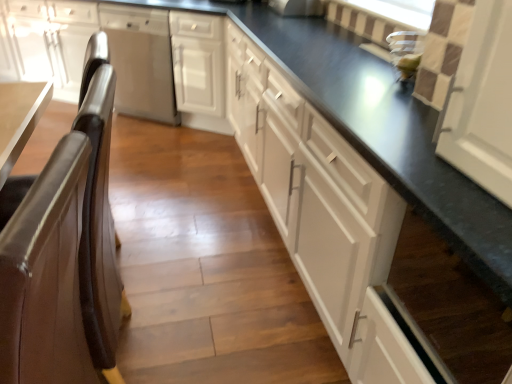
Question: Can we say brown leather chair at left lies outside white matte cabinet at center, marked as the 3th cabinetry in a left-to-right arrangement?

Choices:
 (A) no
 (B) yes

Answer: (B)

Question: From the image's perspective, is brown leather chair at left below white matte cabinet at center, marked as the 3th cabinetry in a left-to-right arrangement?

Choices:
 (A) no
 (B) yes

Answer: (B)

Question: Could you tell me if brown leather chair at left is turned towards white matte cabinet at center, marked as the 3th cabinetry in a left-to-right arrangement?

Choices:
 (A) yes
 (B) no

Answer: (B)

Question: Does brown leather chair at left have a smaller size compared to white matte cabinet at center, the first cabinetry positioned from the right?

Choices:
 (A) yes
 (B) no

Answer: (A)

Question: Would you say brown leather chair at left is a long distance from white matte cabinet at center, the first cabinetry positioned from the right?

Choices:
 (A) no
 (B) yes

Answer: (A)

Question: From the image's perspective, would you say brown leather chair at left is positioned over white matte cabinet at center, the first cabinetry positioned from the right?

Choices:
 (A) no
 (B) yes

Answer: (A)

Question: Is white matte cabinet at center, which is the 2th cabinetry in left-to-right order, thinner than white matte cabinet at center, marked as the 3th cabinetry in a left-to-right arrangement?

Choices:
 (A) yes
 (B) no

Answer: (B)

Question: Would you say white matte cabinet at center, the first cabinetry positioned from the right, is part of white matte cabinet at center, which is the 2th cabinetry in left-to-right order,'s contents?

Choices:
 (A) no
 (B) yes

Answer: (A)

Question: Considering the relative sizes of white matte cabinet at center, which is the 2th cabinetry in left-to-right order, and white matte cabinet at center, the first cabinetry positioned from the right, in the image provided, is white matte cabinet at center, which is the 2th cabinetry in left-to-right order, smaller than white matte cabinet at center, the first cabinetry positioned from the right,?

Choices:
 (A) no
 (B) yes

Answer: (B)

Question: Considering the relative sizes of white matte cabinet at center, which is the 2th cabinetry in left-to-right order, and white matte cabinet at center, the first cabinetry positioned from the right, in the image provided, is white matte cabinet at center, which is the 2th cabinetry in left-to-right order, wider than white matte cabinet at center, the first cabinetry positioned from the right,?

Choices:
 (A) yes
 (B) no

Answer: (A)

Question: From the image's perspective, does white matte cabinet at center, which is the 2th cabinetry in left-to-right order, appear higher than white matte cabinet at center, marked as the 3th cabinetry in a left-to-right arrangement?

Choices:
 (A) no
 (B) yes

Answer: (B)

Question: Is white matte cabinet at center, arranged as the second cabinetry when viewed from the right, positioned with its back to white matte cabinet at center, the first cabinetry positioned from the right?

Choices:
 (A) yes
 (B) no

Answer: (A)

Question: Is white matte cabinet at center, arranged as the second cabinetry when viewed from the right, completely or partially inside brown leather chair at left?

Choices:
 (A) yes
 (B) no

Answer: (B)